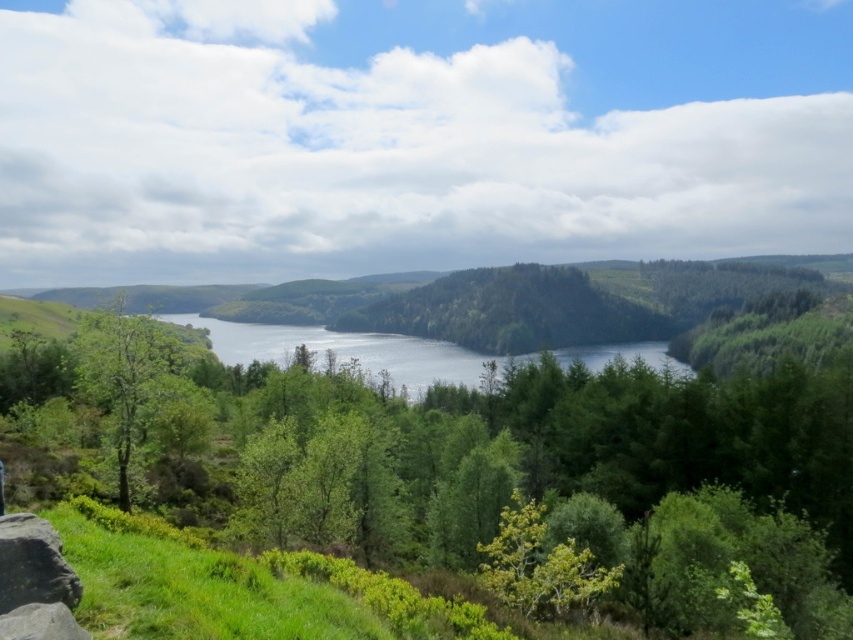
Question: Which point appears farthest from the camera in this image?

Choices:
 (A) (230, 353)
 (B) (16, 580)

Answer: (A)

Question: Which point is closer to the camera?

Choices:
 (A) (440, 353)
 (B) (38, 589)

Answer: (B)

Question: Observing the image, what is the correct spatial positioning of clear blue water at center in reference to smooth gray rock at lower left?

Choices:
 (A) above
 (B) below

Answer: (B)

Question: Considering the relative positions of clear blue water at center and smooth gray rock at lower left in the image provided, where is clear blue water at center located with respect to smooth gray rock at lower left?

Choices:
 (A) below
 (B) above

Answer: (A)

Question: Is clear blue water at center to the right of smooth gray rock at lower left from the viewer's perspective?

Choices:
 (A) no
 (B) yes

Answer: (A)